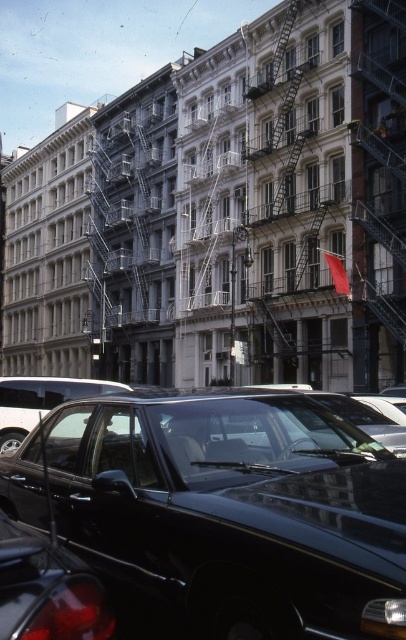
You are a delivery person trying to park your van between the glossy black car at lower center and the glossy plastic car at lower left. Can you fit your van, which is 2 meters wide, between them?

The glossy black car at lower center is positioned on the right side of the glossy plastic car at lower left, so the distance between them is not specified. However, since the question provides no information about the spacing between the cars, it is impossible to determine if the van can fit.

You are a delivery person trying to park your van between the glossy black car at lower center and the glossy plastic car at lower left. The van requires a space of at least 2 meters in length. Can you determine if there is enough space between these two cars?

The glossy black car at lower center has a larger size compared to glossy plastic car at lower left. However, the exact distance between them isn not specified in the provided information. Without knowing the distance between the cars, it is impossible to determine if the space is sufficient for the van.